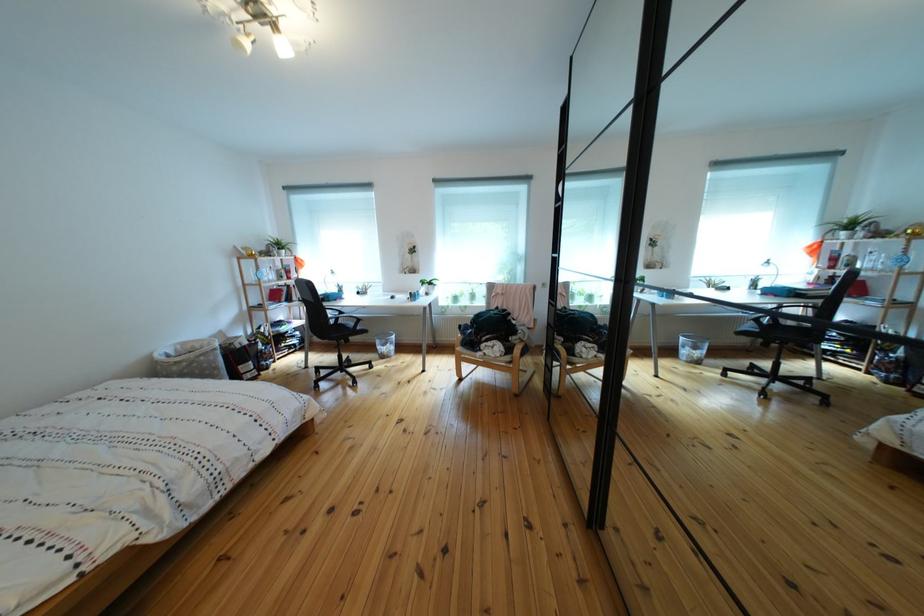
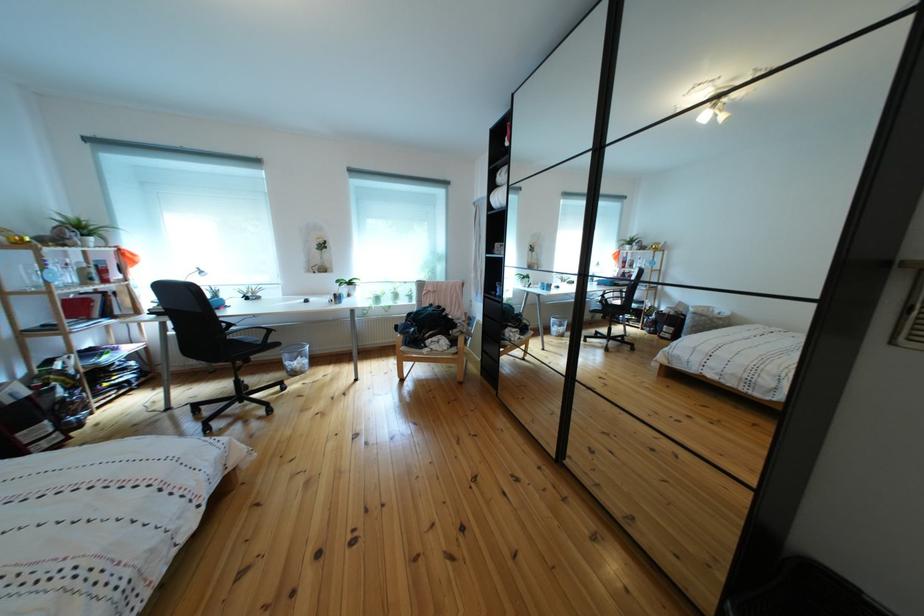
Question: How did the camera likely rotate?

Choices:
 (A) Left
 (B) Right
 (C) Up
 (D) Down

Answer: (B)